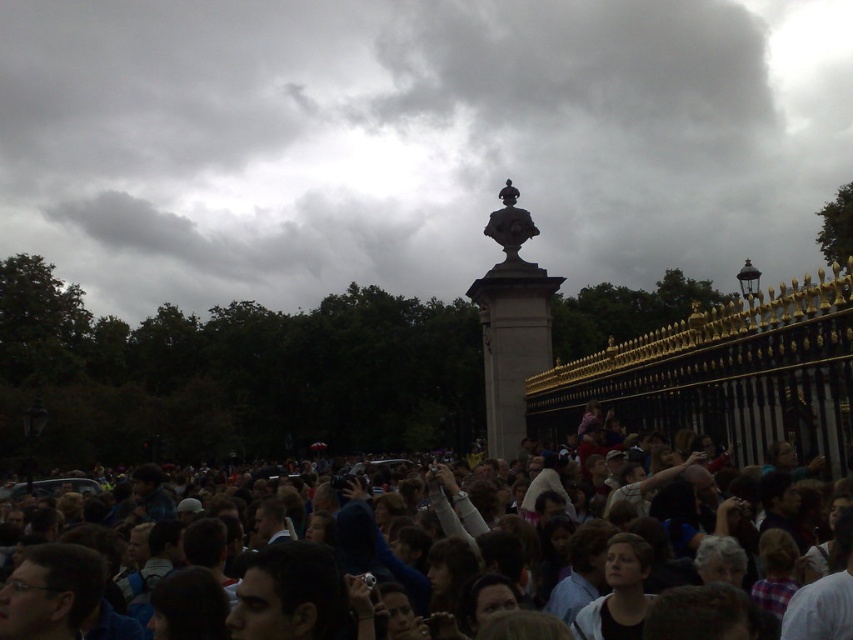
You are a photographer trying to capture a clear shot of the dark stone column at center without the dark gray crowd at center blocking it. Based on the scene, is this possible?

The dark stone column at center is located above the dark gray crowd at center, so it is possible to capture a clear shot by angling the camera upwards to avoid the crowd.

You are a photographer trying to capture a photo of the dark stone column at center without any people blocking it. Given that the dark gray crowd at center is standing between you and the column, can you adjust your position to take the shot?

The dark stone column at center is taller than the dark gray crowd at center, so you can adjust your angle or position to take the photo by looking over the crowd since the column is taller.